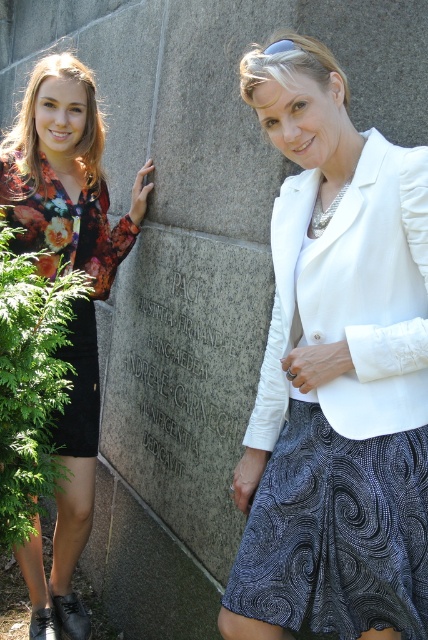
Question: Is the position of floral print dress at left less distant than that of black granite stone at center?

Choices:
 (A) no
 (B) yes

Answer: (A)

Question: Which point is farther to the camera?

Choices:
 (A) white satin blazer at center
 (B) floral print dress at left

Answer: (B)

Question: Can you confirm if white satin blazer at center is bigger than black granite stone at center?

Choices:
 (A) yes
 (B) no

Answer: (B)

Question: Estimate the real-world distances between objects in this image. Which object is closer to the black granite stone at center?

Choices:
 (A) floral print dress at left
 (B) floral printed dress at left

Answer: (B)

Question: Among these objects, which one is nearest to the camera?

Choices:
 (A) white satin blazer at center
 (B) floral printed dress at left
 (C) black granite stone at center
 (D) floral print dress at left

Answer: (A)

Question: Can you confirm if white satin blazer at center is positioned above floral print dress at left?

Choices:
 (A) no
 (B) yes

Answer: (B)